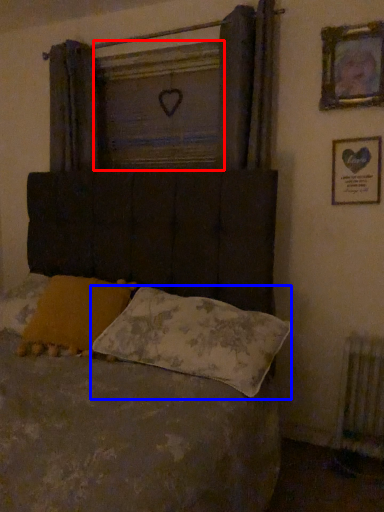
Question: Which of the following is the farthest to the observer, window screen (highlighted by a red box) or pillow (highlighted by a blue box)?

Choices:
 (A) window screen
 (B) pillow

Answer: (A)